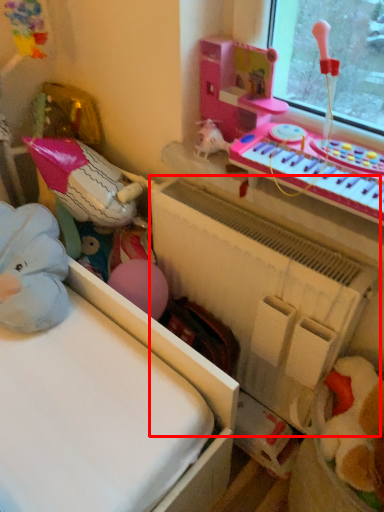
Question: Observing the image, what is the correct spatial positioning of radiator (annotated by the red box) in reference to musical keyboard?

Choices:
 (A) right
 (B) left

Answer: (B)